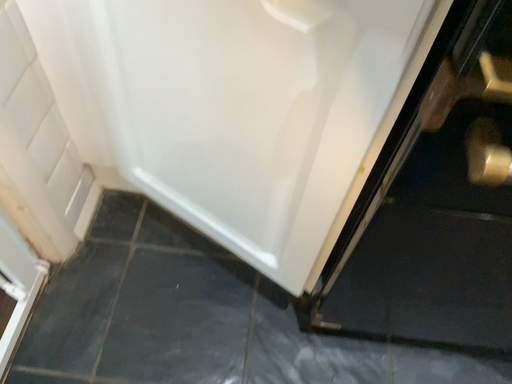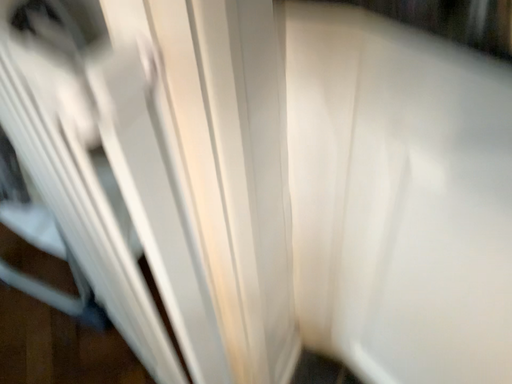
Question: How did the camera likely rotate when shooting the video?

Choices:
 (A) rotated downward
 (B) rotated upward

Answer: (B)